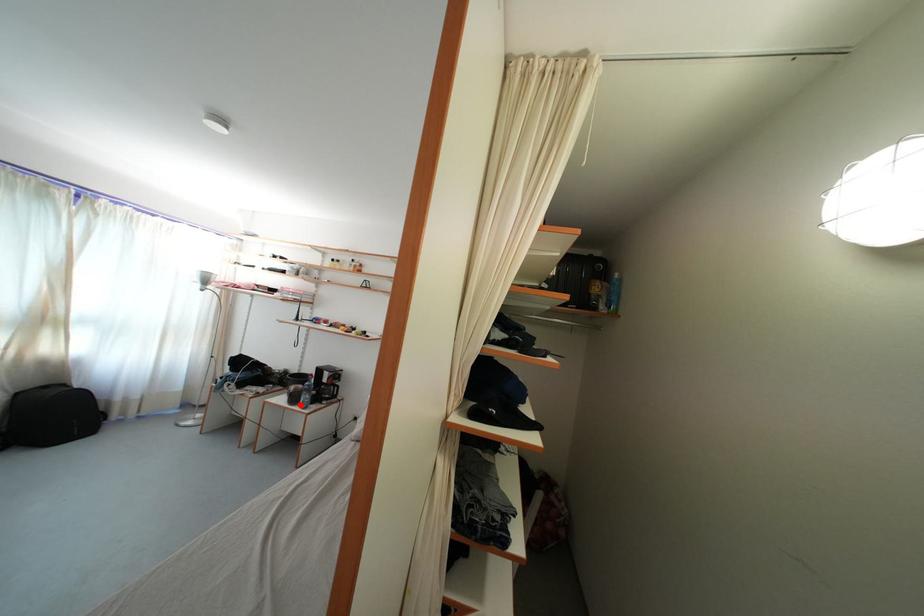
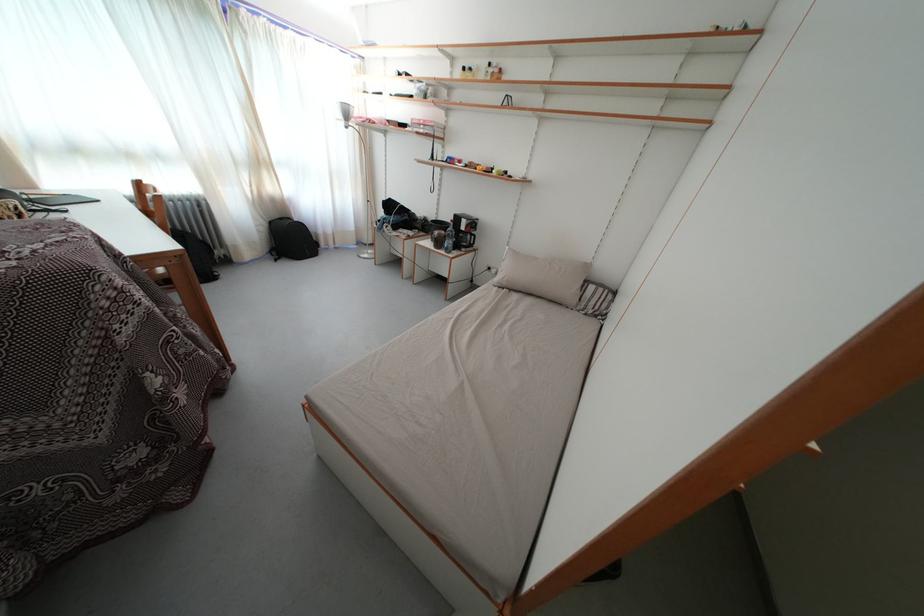
Question: I am providing you with two images of the same scene from different viewpoints. In image1, a red point is highlighted. Considering the same 3D point in image2, which of the following is correct?

Choices:
 (A) It is closer
 (B) It is farther

Answer: (A)